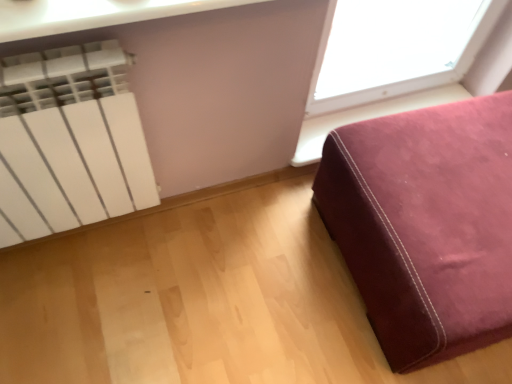
Locate an element on the screen. The width and height of the screenshot is (512, 384). vacant space in white matte radiator at upper left (from a real-world perspective) is located at coordinates (88, 241).